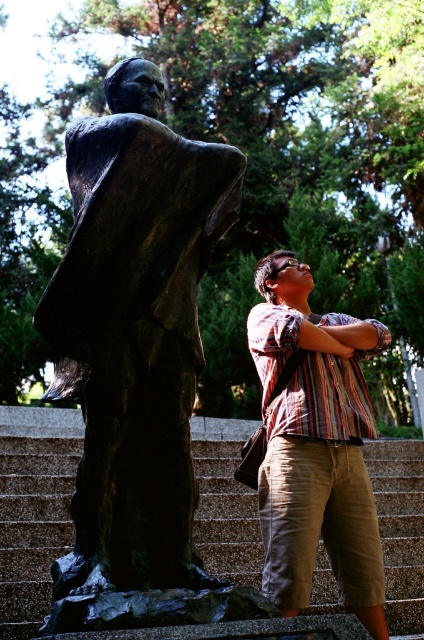
Question: Can you confirm if bronze statue at left is positioned above granite stairs at center?

Choices:
 (A) no
 (B) yes

Answer: (B)

Question: Does bronze statue at left have a greater width compared to striped cotton shirt at center?

Choices:
 (A) no
 (B) yes

Answer: (A)

Question: Which point appears closest to the camera in this image?

Choices:
 (A) (139, 480)
 (B) (44, 445)

Answer: (A)

Question: Can you confirm if bronze statue at left is smaller than striped cotton shirt at center?

Choices:
 (A) no
 (B) yes

Answer: (B)

Question: Which point is farther from the camera taking this photo?

Choices:
 (A) coord(229,458)
 (B) coord(83,506)
 (C) coord(273,440)

Answer: (A)

Question: Which point is closer to the camera?

Choices:
 (A) bronze statue at left
 (B) striped cotton shirt at center
 (C) granite stairs at center

Answer: (A)